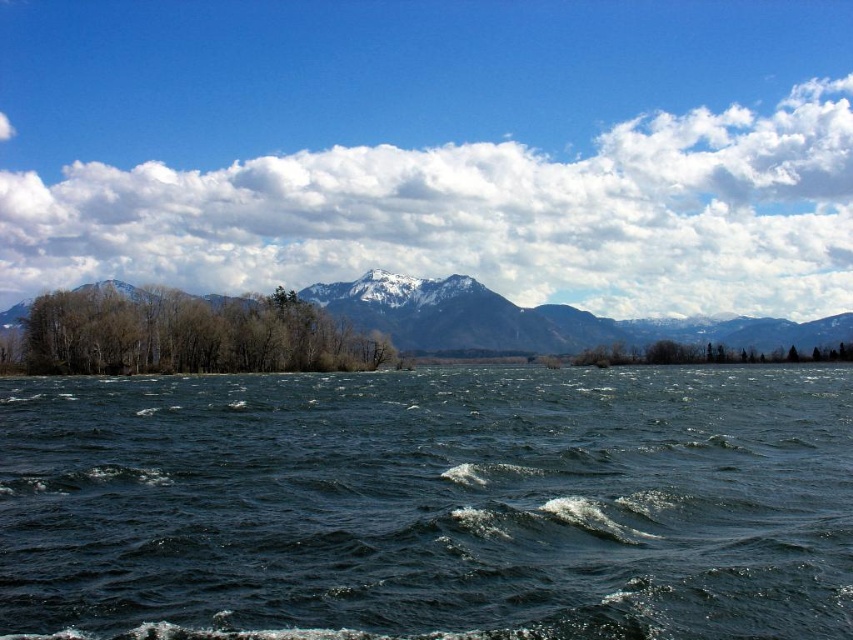
Question: Where is green leafy trees at lower left located in relation to green leafy trees at center in the image?

Choices:
 (A) right
 (B) left

Answer: (B)

Question: Which point is closer to the camera taking this photo?

Choices:
 (A) (552, 310)
 (B) (538, 634)
 (C) (109, 323)

Answer: (B)

Question: Which object is closer to the camera taking this photo?

Choices:
 (A) green leafy trees at center
 (B) snowy mountain at upper center
 (C) white fluffy cloud at upper center
 (D) dark blue water at center

Answer: (D)

Question: Is white fluffy cloud at upper center to the right of green leafy trees at lower left from the viewer's perspective?

Choices:
 (A) yes
 (B) no

Answer: (A)

Question: Where is green leafy trees at lower left located in relation to green leafy trees at center in the image?

Choices:
 (A) right
 (B) left

Answer: (B)

Question: Which of the following is the farthest from the observer?

Choices:
 (A) white fluffy cloud at upper center
 (B) green leafy trees at lower left
 (C) snowy mountain at upper center

Answer: (A)